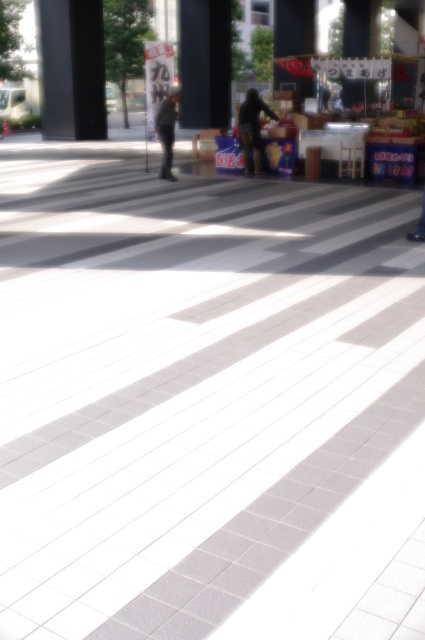
Based on the photo, who is taller, smooth black pillar at upper left or dark matte figure at center?

dark matte figure at center is taller.

Who is more forward, (x=96, y=76) or (x=255, y=145)?

Point (x=255, y=145)

This screenshot has width=425, height=640. Identify the location of smooth black pillar at upper left. (70, 68).

The image size is (425, 640). Identify the location of dark matte figure at center. (252, 129).

Does point (102, 29) come closer to viewer compared to point (167, 173)?

That is False.

Where is `smooth black pillar at upper left`? This screenshot has width=425, height=640. smooth black pillar at upper left is located at coordinates (70, 68).

The image size is (425, 640). Find the location of `smooth black pillar at upper left`. smooth black pillar at upper left is located at coordinates point(70,68).